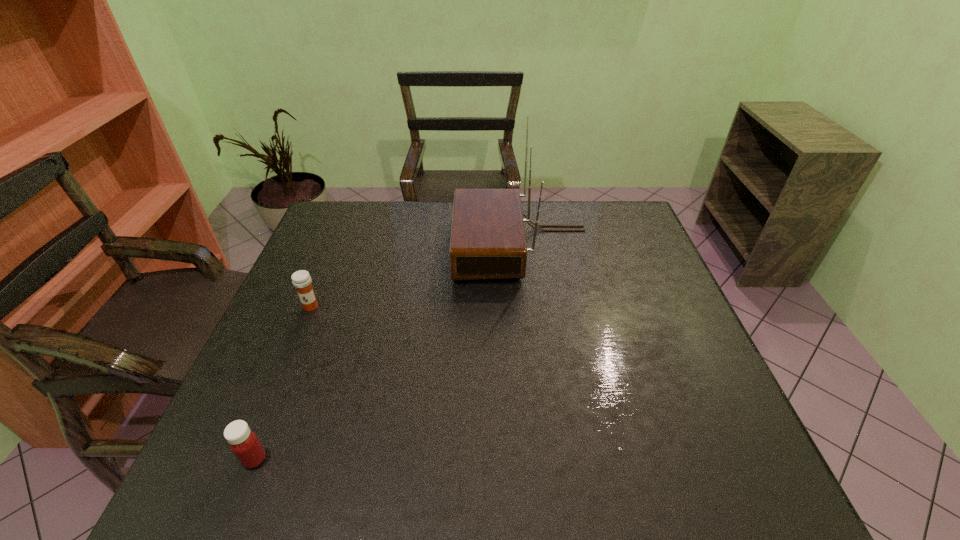
Identify the location of vacant space that satisfies the following two spatial constraints: 1. on the label side of the nearest object; 2. on the right side of the farther medicine. (249, 459).